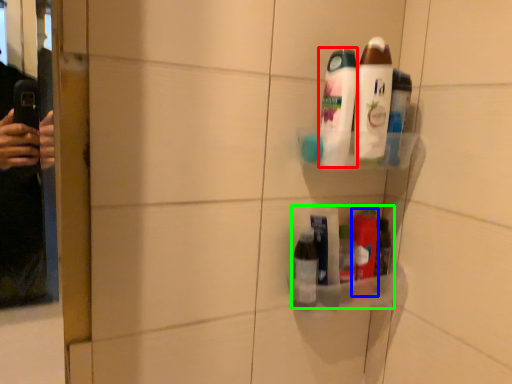
Question: Estimate the real-world distances between objects in this image. Which object is farther from toiletry (highlighted by a red box), toiletry (highlighted by a blue box) or product (highlighted by a green box)?

Choices:
 (A) toiletry
 (B) product

Answer: (A)